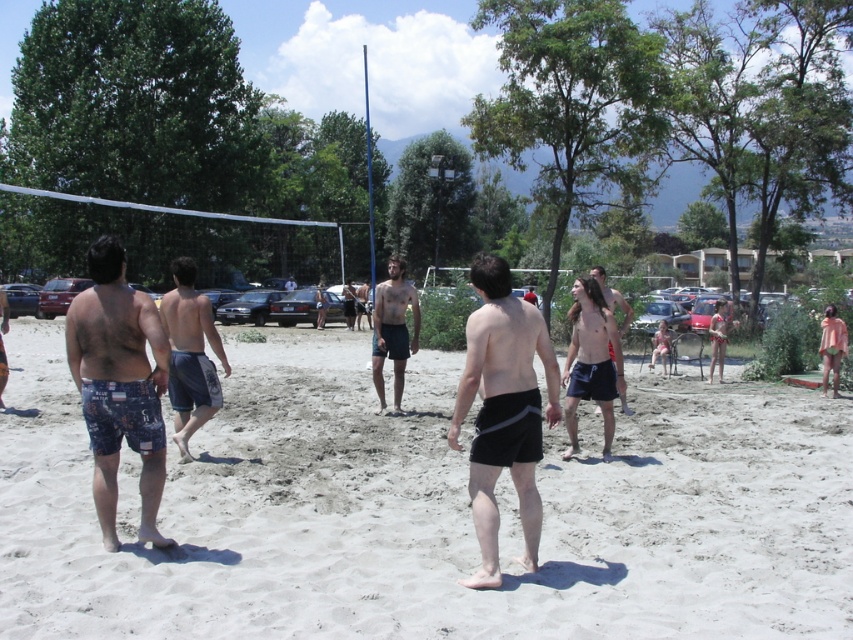
Question: Estimate the real-world distances between objects in this image. Which object is closer to the white sandy beach at center?

Choices:
 (A) black matte shorts at center
 (B) dark blue shorts at center
 (C) shiny black shorts at center

Answer: (C)

Question: Does shiny black shorts at center appear over printed fabric shorts at left?

Choices:
 (A) no
 (B) yes

Answer: (A)

Question: Can you confirm if dark blue shorts at center is positioned to the right of printed fabric shorts at left?

Choices:
 (A) yes
 (B) no

Answer: (A)

Question: Where is white sandy beach at center located in relation to printed fabric shorts at left in the image?

Choices:
 (A) above
 (B) below

Answer: (B)

Question: Which object appears closest to the camera in this image?

Choices:
 (A) white sandy beach at center
 (B) printed fabric shorts at left
 (C) shiny black shorts at center

Answer: (A)

Question: Which of the following is the closest to the observer?

Choices:
 (A) printed fabric shorts at left
 (B) shiny black shorts at center

Answer: (B)